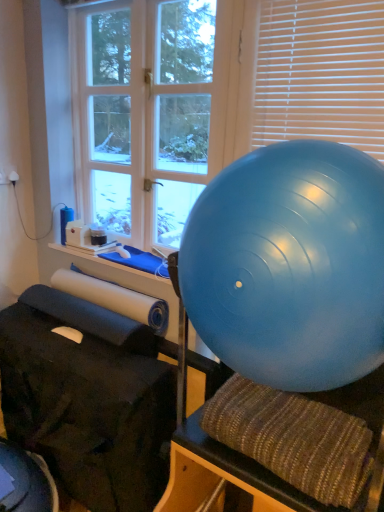
Question: From a real-world perspective, does white plastic blinds at upper right sit lower than white wood window at upper left?

Choices:
 (A) yes
 (B) no

Answer: (B)

Question: Is white plastic blinds at upper right wider than white wood window at upper left?

Choices:
 (A) no
 (B) yes

Answer: (A)

Question: Considering the relative positions of white plastic blinds at upper right and white wood window at upper left in the image provided, is white plastic blinds at upper right behind white wood window at upper left?

Choices:
 (A) no
 (B) yes

Answer: (A)

Question: Is the depth of white plastic blinds at upper right less than that of white wood window at upper left?

Choices:
 (A) yes
 (B) no

Answer: (A)

Question: Is white plastic blinds at upper right taller than white wood window at upper left?

Choices:
 (A) no
 (B) yes

Answer: (A)

Question: In terms of width, does white wood window at upper left look wider or thinner when compared to white plastic blinds at upper right?

Choices:
 (A) thin
 (B) wide

Answer: (B)

Question: In the image, is white wood window at upper left on the left side or the right side of white plastic blinds at upper right?

Choices:
 (A) right
 (B) left

Answer: (B)

Question: Considering their positions, is white wood window at upper left located in front of or behind white plastic blinds at upper right?

Choices:
 (A) behind
 (B) front

Answer: (A)

Question: From the image's perspective, is white wood window at upper left above or below white plastic blinds at upper right?

Choices:
 (A) above
 (B) below

Answer: (A)

Question: Is white wood window at upper left spatially inside blue rubber ball at right, or outside of it?

Choices:
 (A) inside
 (B) outside

Answer: (B)

Question: Is white wood window at upper left to the left or to the right of blue rubber ball at right in the image?

Choices:
 (A) right
 (B) left

Answer: (B)

Question: Does point (157, 10) appear closer or farther from the camera than point (339, 288)?

Choices:
 (A) farther
 (B) closer

Answer: (A)

Question: From the image's perspective, relative to blue rubber ball at right, is white wood window at upper left above or below?

Choices:
 (A) above
 (B) below

Answer: (A)

Question: Considering the positions of white plastic blinds at upper right and white wood window at upper left in the image, is white plastic blinds at upper right bigger or smaller than white wood window at upper left?

Choices:
 (A) big
 (B) small

Answer: (B)

Question: Looking at their shapes, would you say white plastic blinds at upper right is wider or thinner than white wood window at upper left?

Choices:
 (A) wide
 (B) thin

Answer: (B)